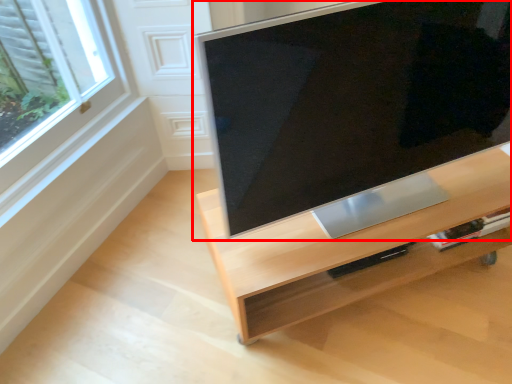
Question: Observing the image, what is the correct spatial positioning of television (annotated by the red box) in reference to furniture?

Choices:
 (A) left
 (B) right

Answer: (B)